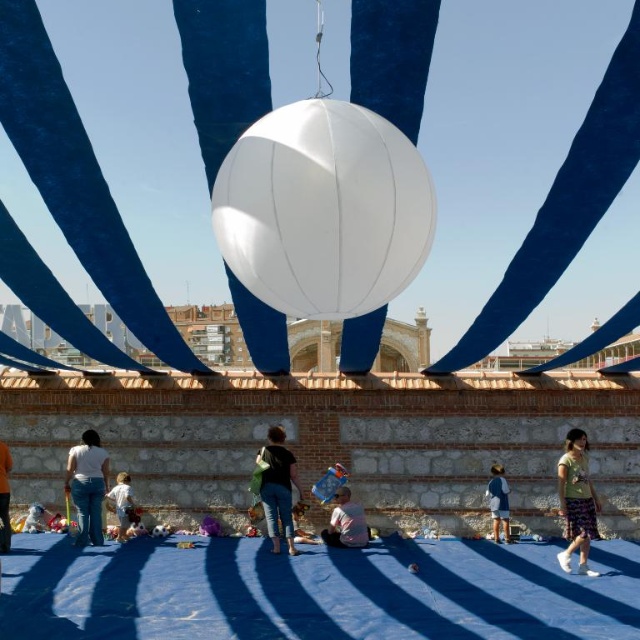
Question: Can you confirm if white cotton shirt at lower right is wider than light brown shorts at lower left?

Choices:
 (A) no
 (B) yes

Answer: (B)

Question: Which object is the farthest from the light brown shorts at lower left?

Choices:
 (A) pink fabric at center
 (B) white matte balloon at center
 (C) jeans at center

Answer: (B)

Question: Which point is closer to the camera taking this photo?

Choices:
 (A) (8, 465)
 (B) (353, 515)

Answer: (A)

Question: Which of the following is the farthest from the observer?

Choices:
 (A) white plush toy at center
 (B) white matte balloon at center
 (C) orange sweater at lower left

Answer: (A)

Question: Can you confirm if green cotton shirt at lower right is positioned below white plush toy at center?

Choices:
 (A) yes
 (B) no

Answer: (B)

Question: Can you confirm if green cotton shirt at lower right is positioned below white cotton shirt at lower left?

Choices:
 (A) no
 (B) yes

Answer: (A)